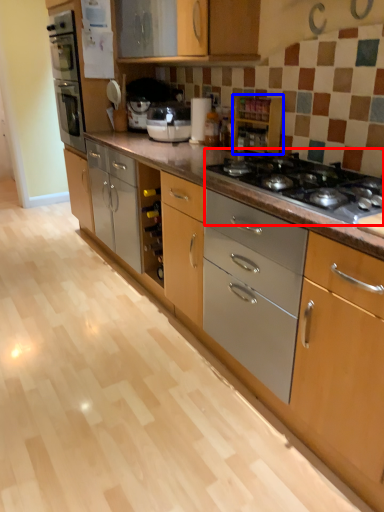
Question: Which of the following is the farthest to the observer, gas stove (highlighted by a red box) or cabinetry (highlighted by a blue box)?

Choices:
 (A) gas stove
 (B) cabinetry

Answer: (B)